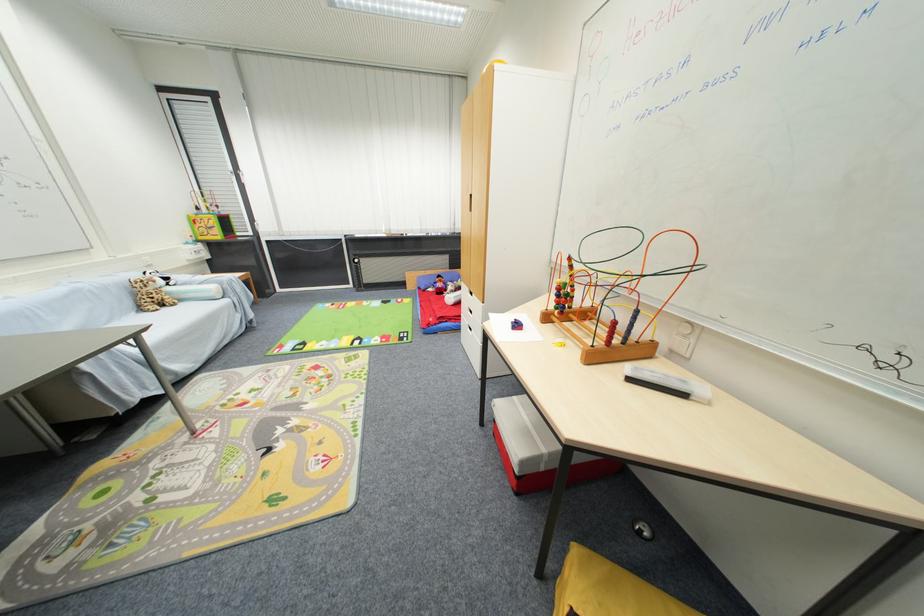
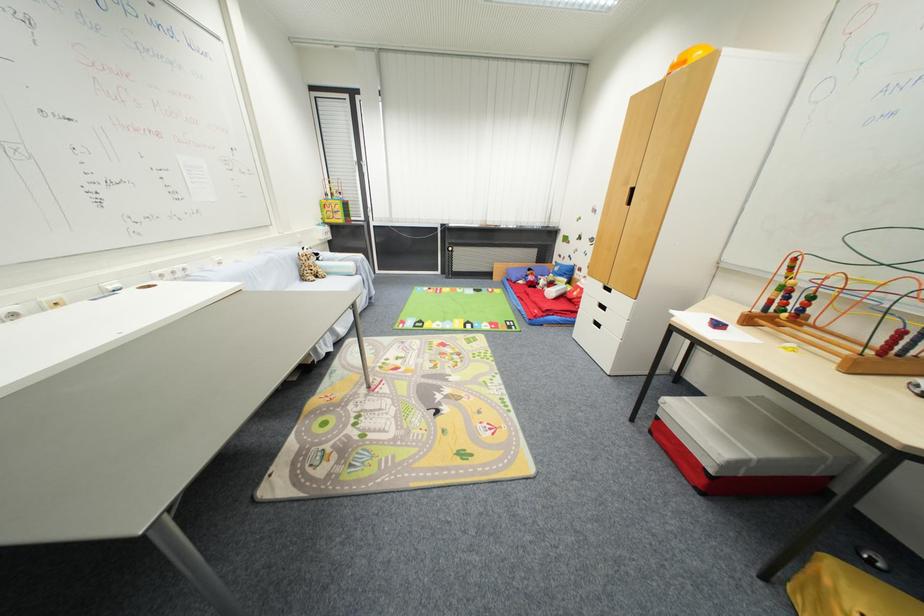
Find the pixel in the second image that matches point 293,369 in the first image.

(423, 342)